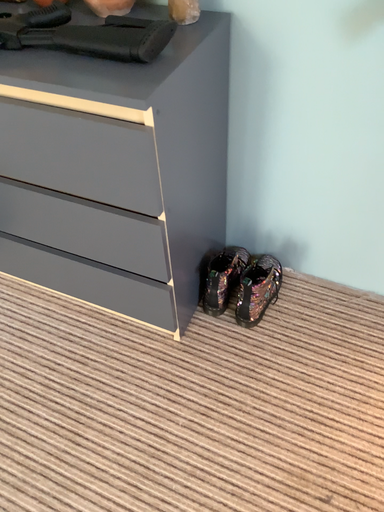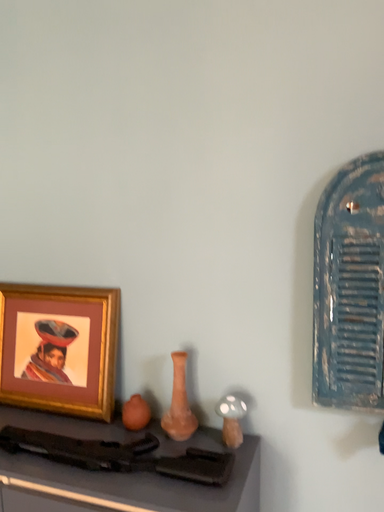
Question: How did the camera likely rotate when shooting the video?

Choices:
 (A) rotated upward
 (B) rotated downward

Answer: (A)